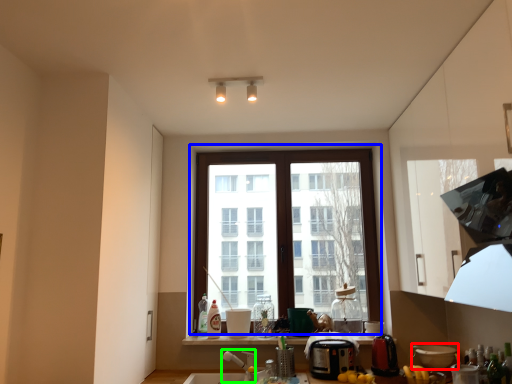
Question: Which is farther away from appliance (highlighted by a red box)? window (highlighted by a blue box) or faucet (highlighted by a green box)?

Choices:
 (A) window
 (B) faucet

Answer: (B)